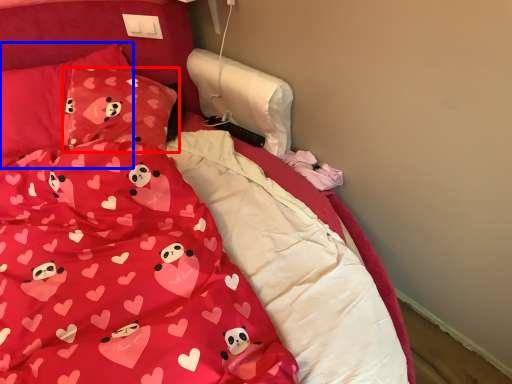
Question: Which point is further to the camera, pillow (highlighted by a red box) or pillow (highlighted by a blue box)?

Choices:
 (A) pillow
 (B) pillow

Answer: (B)